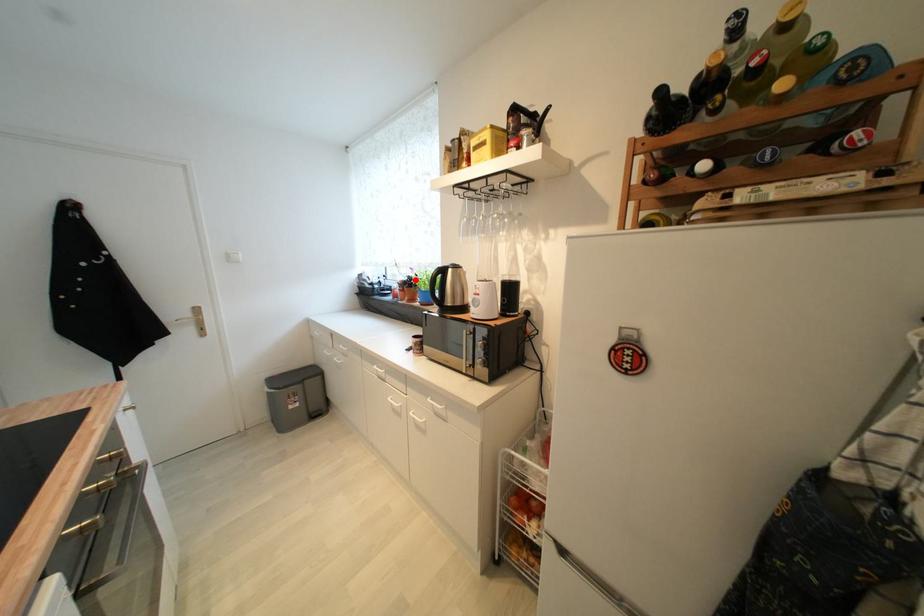
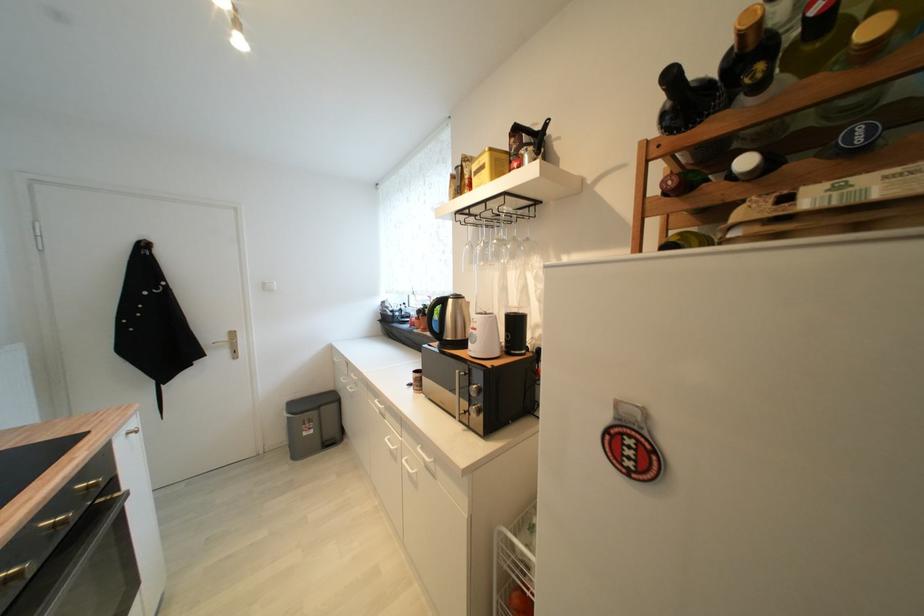
Find the pixel in the second image that matches the highlighted location in the first image.

(431, 309)